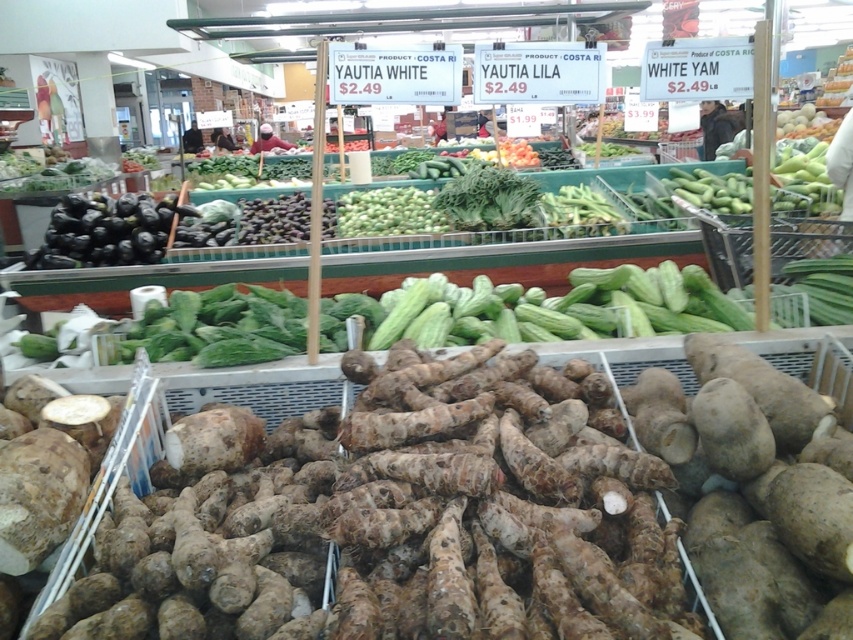
Can you confirm if black matte eggplant at left is smaller than green matte cucumbers at center?

Incorrect, black matte eggplant at left is not smaller in size than green matte cucumbers at center.

The width and height of the screenshot is (853, 640). What do you see at coordinates (107, 230) in the screenshot?
I see `black matte eggplant at left` at bounding box center [107, 230].

Does point (115, 248) lie behind point (358, 198)?

No, it is in front of (358, 198).

This screenshot has height=640, width=853. I want to click on black matte eggplant at left, so click(x=107, y=230).